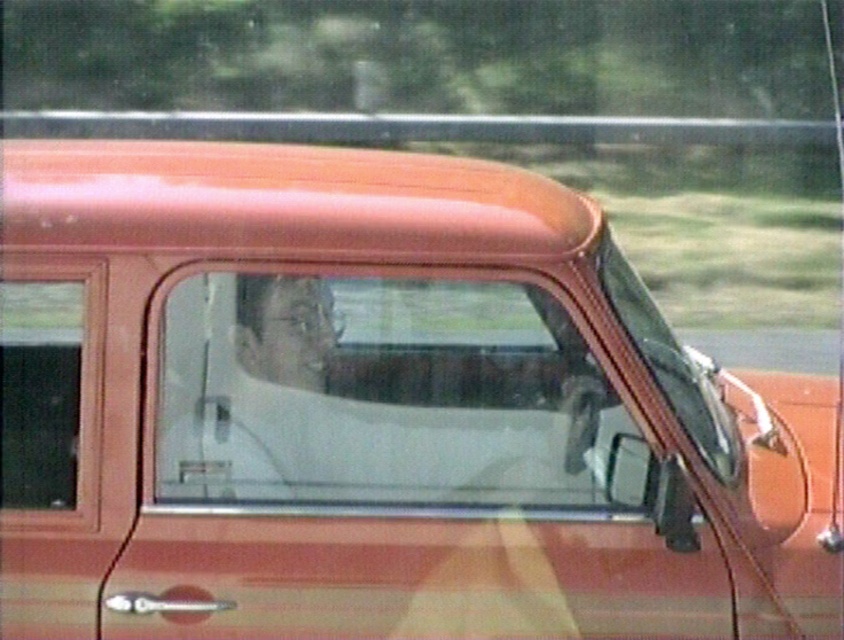
Question: Can you confirm if clear glass window at center is smaller than transparent glass window at left?

Choices:
 (A) no
 (B) yes

Answer: (A)

Question: Which object is closer to the camera taking this photo?

Choices:
 (A) transparent glass window at left
 (B) clear glass window at center

Answer: (A)

Question: Is clear glass window at center to the left of transparent glass window at left from the viewer's perspective?

Choices:
 (A) yes
 (B) no

Answer: (B)

Question: Is clear glass window at center to the right of transparent glass window at left from the viewer's perspective?

Choices:
 (A) yes
 (B) no

Answer: (A)

Question: Which object is farther from the camera taking this photo?

Choices:
 (A) clear glass window at center
 (B) transparent glass window at left

Answer: (A)